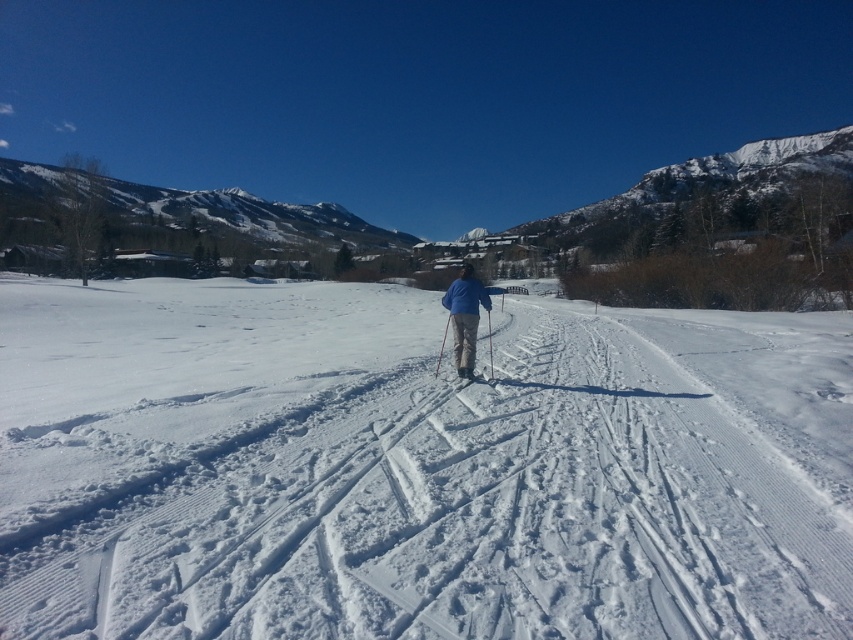
Between white textured snow at center and blue fabric jacket at center, which one appears on the right side from the viewer's perspective?

white textured snow at center is more to the right.

This screenshot has height=640, width=853. Identify the location of white textured snow at center. (415, 467).

Image resolution: width=853 pixels, height=640 pixels. In order to click on white textured snow at center in this screenshot , I will do `click(415, 467)`.

What do you see at coordinates (415, 467) in the screenshot? The image size is (853, 640). I see `white textured snow at center` at bounding box center [415, 467].

Who is more distant from viewer, (115, 609) or (489, 364)?

The point (489, 364) is more distant.

Locate an element on the screen. This screenshot has width=853, height=640. white textured snow at center is located at coordinates pos(415,467).

Does blue fabric jacket at center have a lesser height compared to matte black ski at center?

No.

Does point (479, 282) lie behind point (492, 388)?

That is True.

Between point (457, 332) and point (491, 388), which one is positioned in front?

Point (491, 388)

Locate an element on the screen. This screenshot has height=640, width=853. blue fabric jacket at center is located at coordinates pos(465,316).